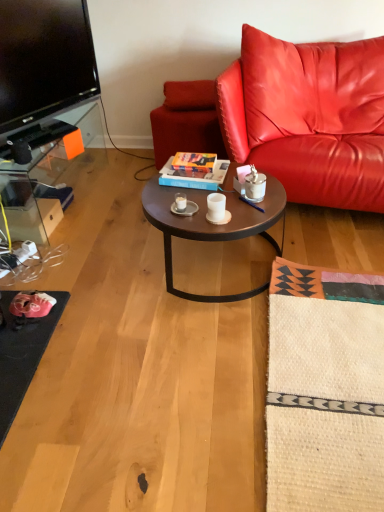
Find the location of a particular element. This screenshot has height=512, width=384. free space on the front side of metallic pen at center is located at coordinates (251, 217).